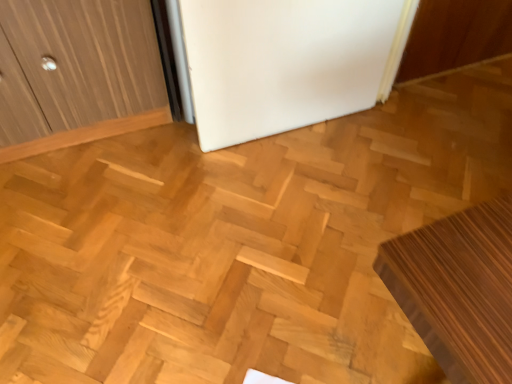
This screenshot has height=384, width=512. I want to click on vacant space to the right of white matte refrigerator at center, so click(x=369, y=160).